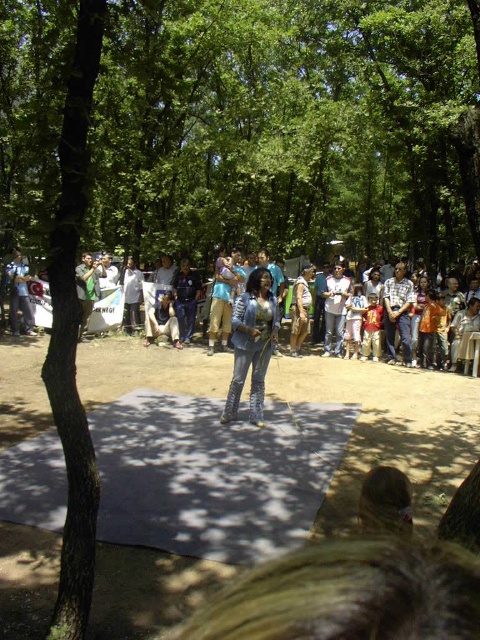
Question: Which of the following is the closest to the observer?

Choices:
 (A) jeans at center
 (B) denim jacket at center

Answer: (B)

Question: Is the position of denim jacket at center less distant than that of denim jeans at center?

Choices:
 (A) yes
 (B) no

Answer: (A)

Question: Based on their relative distances, which object is nearer to the jeans at center?

Choices:
 (A) denim jacket at center
 (B) denim jeans at center

Answer: (B)

Question: Is jeans at center closer to camera compared to denim jeans at center?

Choices:
 (A) yes
 (B) no

Answer: (A)

Question: Among these points, which one is nearest to the camera?

Choices:
 (A) tap(168, 321)
 (B) tap(290, 348)

Answer: (B)

Question: Is jeans at center bigger than denim jeans at center?

Choices:
 (A) no
 (B) yes

Answer: (B)